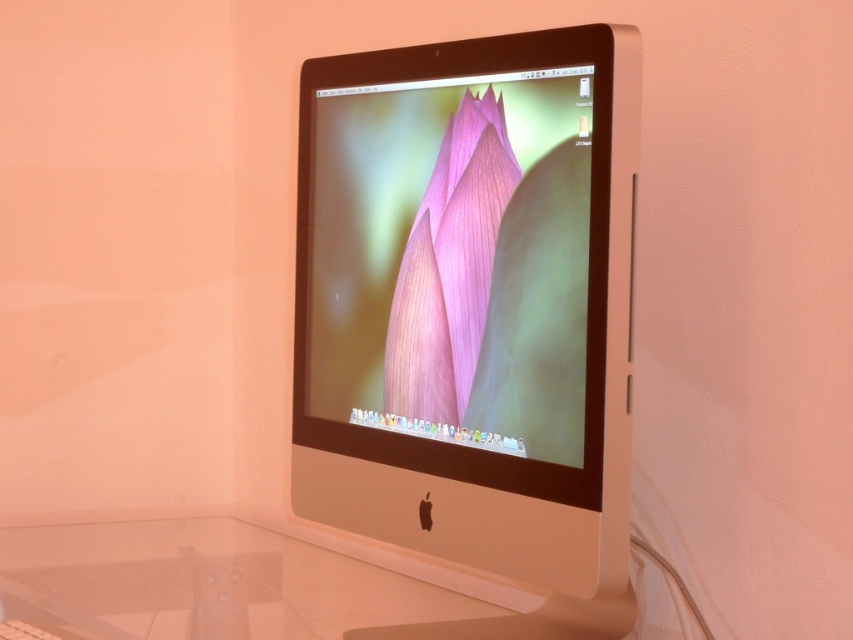
You are a technician trying to clean the screen of the satin white monitor at center. The pink matte flower at center is an object on the desk. Can you safely clean the monitor without touching the flower?

The satin white monitor at center is in front of the pink matte flower at center, so you can clean the monitor without touching the flower as they are separate objects in different positions.